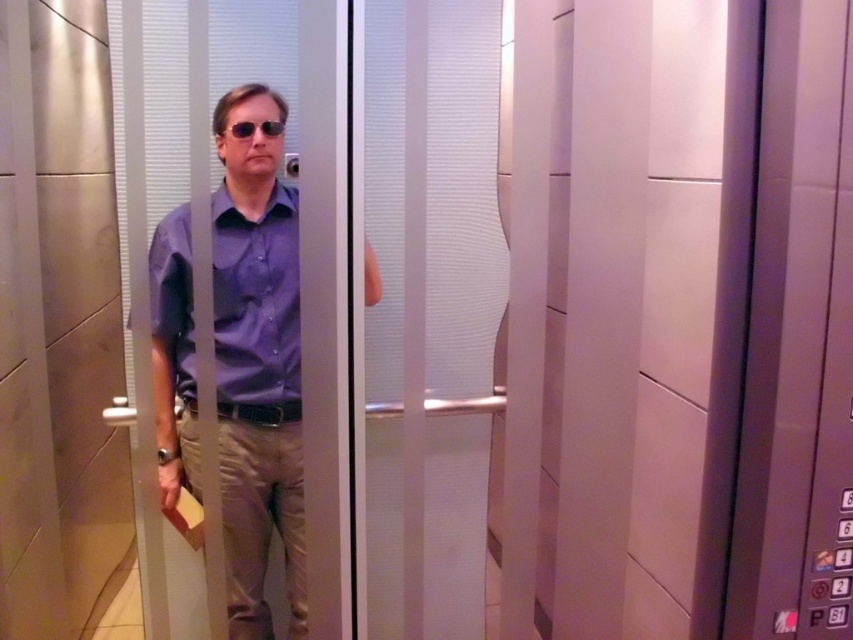
You are an elevator inspector checking the placement of the purple shirt at center and the purple smooth shirt at center. Which shirt is located to the right of the other?

The purple shirt at center is positioned on the right side of the purple smooth shirt at center.

You are a security camera inside the elevator. You need to determine if the purple smooth shirt at center is taller than the matte black sunglasses at center. Based on the scene description, what is your conclusion?

The purple smooth shirt at center has a greater height compared to the matte black sunglasses at center, so yes, the purple smooth shirt at center is taller than the matte black sunglasses at center.

You are designing a uniform for elevator maintenance workers and need to ensure that the sunglasses provided are not too large for their pockets. Given that the purple smooth shirt at center is part of the uniform and the matte black sunglasses at center are the proposed design, can the sunglasses fit into a pocket designed to hold items the size of the shirt?

The purple smooth shirt at center is bigger than the matte black sunglasses at center, so the sunglasses would fit into a pocket designed for the shirt since they are smaller.